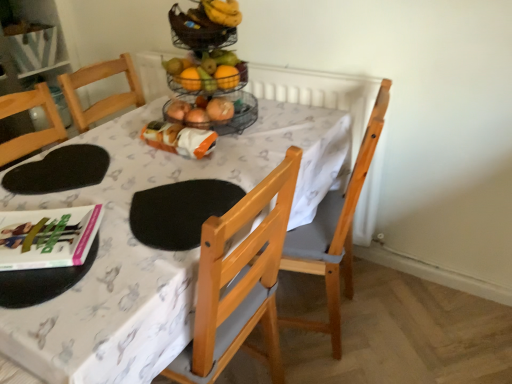
This screenshot has height=384, width=512. What are the coordinates of `free spot above white fabric table at center (from a real-world perspective)` in the screenshot? It's located at (109, 196).